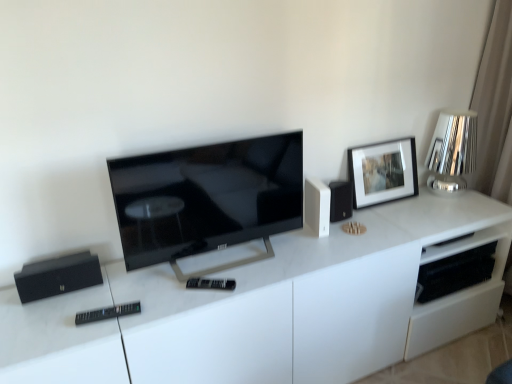
Where is `free space to the back side of black plastic remote at lower left, marked as the 1th remote in a bottom-to-top arrangement`? free space to the back side of black plastic remote at lower left, marked as the 1th remote in a bottom-to-top arrangement is located at coordinates (127, 292).